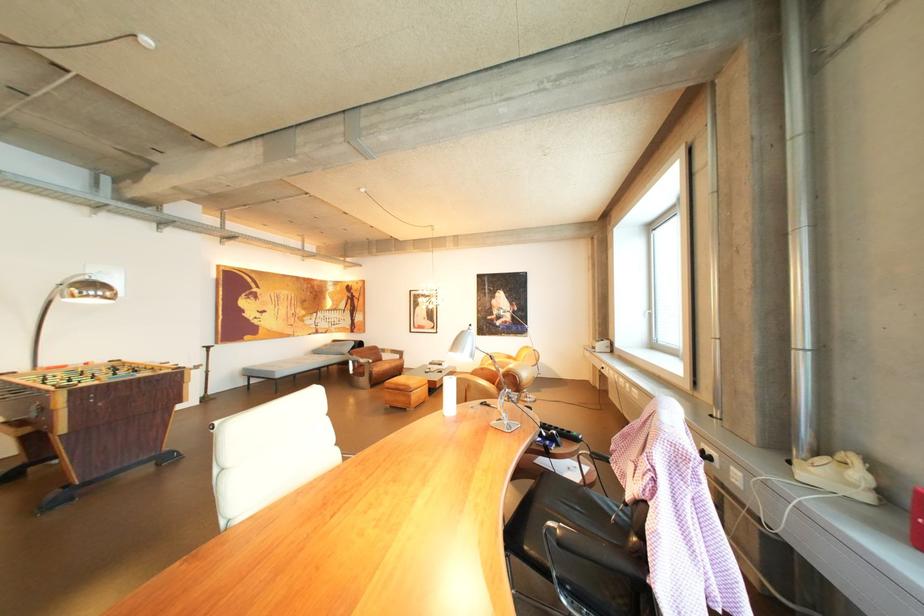
Find the location of a particular element. The image size is (924, 616). grey sofa sitting surface is located at coordinates (286, 366).